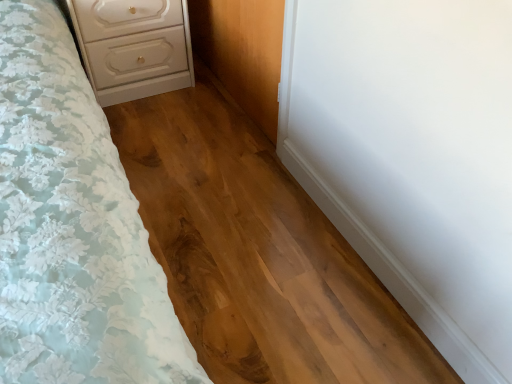
Where is `white glossy chest of drawers at upper left`? white glossy chest of drawers at upper left is located at coordinates (133, 47).

This screenshot has height=384, width=512. What do you see at coordinates (133, 47) in the screenshot?
I see `white glossy chest of drawers at upper left` at bounding box center [133, 47].

You are a GUI agent. You are given a task and a screenshot of the screen. Output one action in this format:
    pyautogui.click(x=<x>, y=<y>)
    Task: Click on the white glossy chest of drawers at upper left
    
    Given the screenshot: What is the action you would take?
    pyautogui.click(x=133, y=47)